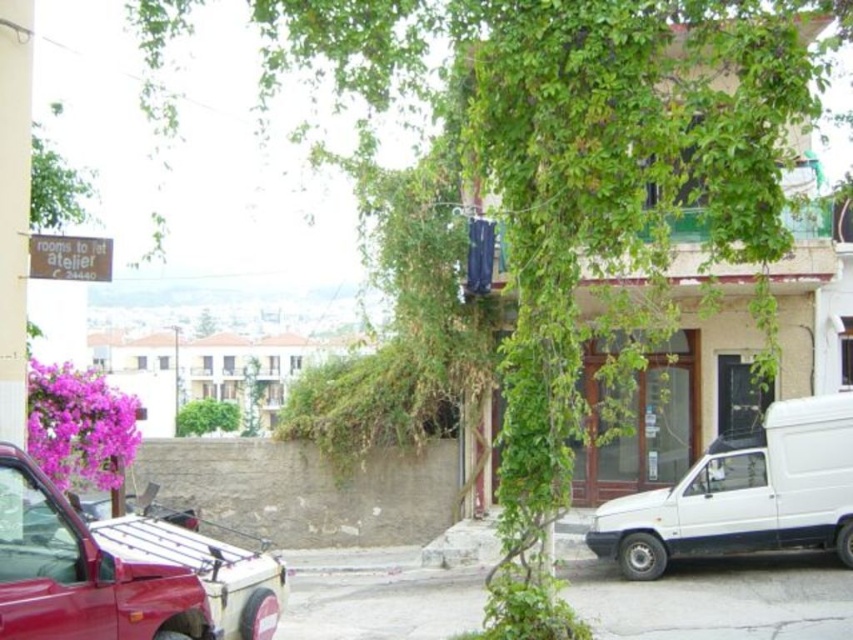
You are a delivery person trying to park your vehicle in this street scene. You need to know which vehicle takes up less space. Which one between the metallic red car at lower left and the white matte van at lower right is smaller?

The metallic red car at lower left is smaller than the white matte van at lower right, so it takes up less space.

You are a pedestrian standing at the crosswalk and want to cross the street. There is a metallic red car at lower left and a white matte van at lower right. Which vehicle is blocking your path more?

The metallic red car at lower left is positioned over the white matte van at lower right, meaning it is closer to the crosswalk and thus blocking the path more.

You are a pedestrian standing on the sidewalk and want to cross the street to reach the building with the wooden door. Which vehicle, the metallic red car at lower left or the white matte van at lower right, is closer to you as you stand on the sidewalk?

The metallic red car at lower left is closer to you than the white matte van at lower right because it is positioned nearer to the viewer.